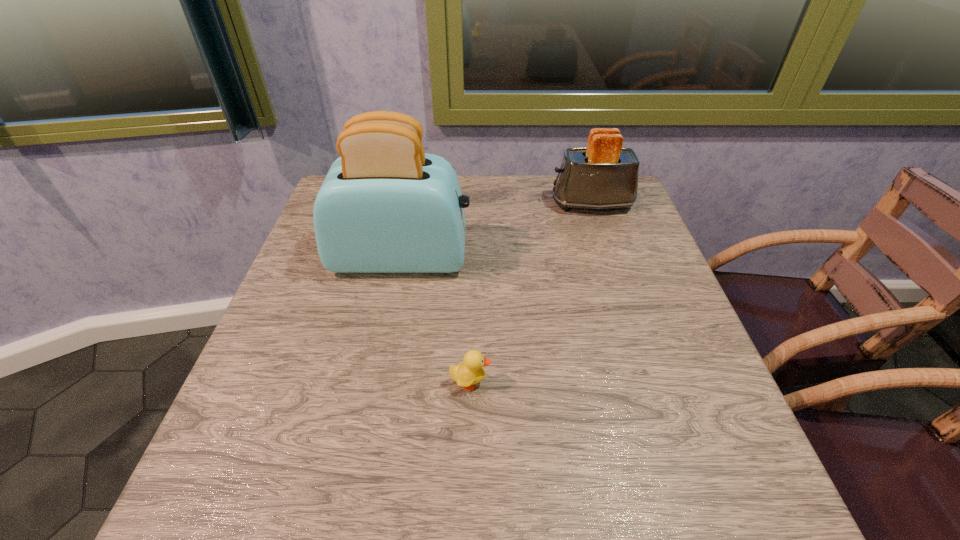
Locate an element on the screen. The width and height of the screenshot is (960, 540). object that ranks as the closest to the tallest object is located at coordinates (604, 175).

Find the location of `object that is the second closest to the taller toaster`. object that is the second closest to the taller toaster is located at coordinates pos(471,372).